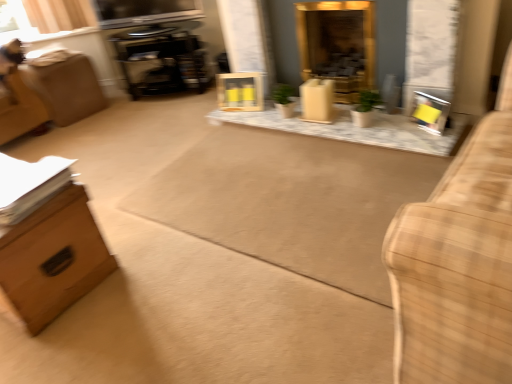
Question: Does wooden frame at center, the first picture frame positioned from the left, have a lesser height compared to brown cardboard box at left?

Choices:
 (A) yes
 (B) no

Answer: (A)

Question: From a real-world perspective, is wooden frame at center, the first picture frame in the top-to-bottom sequence, physically below brown cardboard box at left?

Choices:
 (A) no
 (B) yes

Answer: (B)

Question: Can brown cardboard box at left be found inside wooden frame at center, the first picture frame in the top-to-bottom sequence?

Choices:
 (A) yes
 (B) no

Answer: (B)

Question: Is wooden frame at center, the first picture frame in the top-to-bottom sequence, at the right side of brown cardboard box at left?

Choices:
 (A) yes
 (B) no

Answer: (A)

Question: Is wooden frame at center, placed as the second picture frame when sorted from right to left, far from brown cardboard box at left?

Choices:
 (A) yes
 (B) no

Answer: (A)

Question: Is wooden frame at center, arranged as the second picture frame when viewed from the front, further to the viewer compared to brown cardboard box at left?

Choices:
 (A) yes
 (B) no

Answer: (A)

Question: Can you confirm if yellow cardboard picture frame at right, which is the 1th picture frame in front-to-back order, is smaller than matte wood box at center?

Choices:
 (A) no
 (B) yes

Answer: (B)

Question: Is yellow cardboard picture frame at right, which is the 2th picture frame from top to bottom, aimed at matte wood box at center?

Choices:
 (A) yes
 (B) no

Answer: (B)

Question: Is yellow cardboard picture frame at right, which ranks as the first picture frame in bottom-to-top order, at the left side of matte wood box at center?

Choices:
 (A) yes
 (B) no

Answer: (B)

Question: Considering the relative positions of yellow cardboard picture frame at right, acting as the second picture frame starting from the back, and matte wood box at center in the image provided, is yellow cardboard picture frame at right, acting as the second picture frame starting from the back, to the right of matte wood box at center from the viewer's perspective?

Choices:
 (A) no
 (B) yes

Answer: (B)

Question: From the image's perspective, does yellow cardboard picture frame at right, marked as the 1th picture frame in a right-to-left arrangement, appear higher than matte wood box at center?

Choices:
 (A) yes
 (B) no

Answer: (B)

Question: From a real-world perspective, is yellow cardboard picture frame at right, which ranks as the first picture frame in bottom-to-top order, located beneath matte wood box at center?

Choices:
 (A) yes
 (B) no

Answer: (A)

Question: From a real-world perspective, is wooden swivel chair at left under brown cardboard box at left?

Choices:
 (A) yes
 (B) no

Answer: (B)